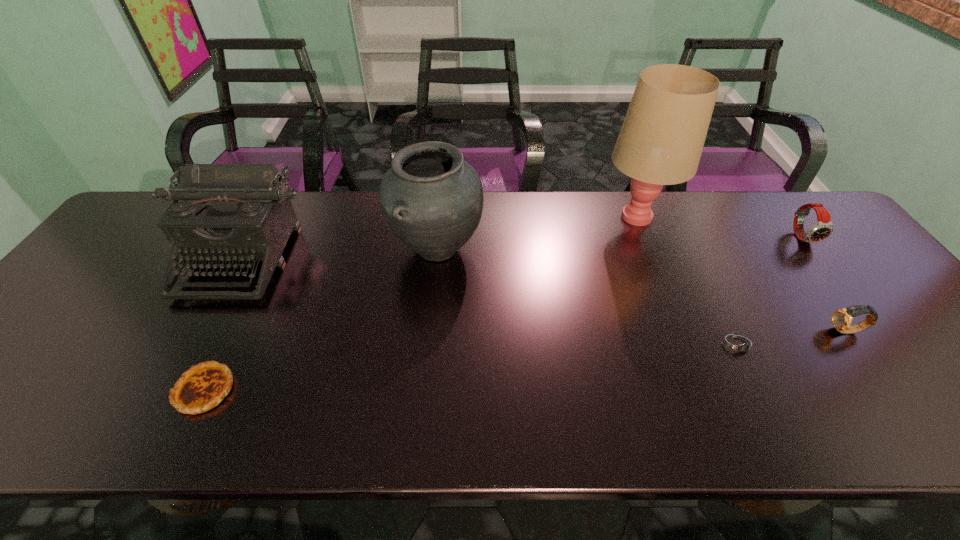
Find the location of a particular element. free space between the third shortest object and the quiche is located at coordinates (525, 360).

Identify the location of vacant region between the farthest watch and the leftmost watch. (771, 291).

Find the location of a particular element. The image size is (960, 540). vacant region between the third object from left to right and the typewriter is located at coordinates (339, 253).

Where is `vacant region between the tallest watch and the quiche`? The height and width of the screenshot is (540, 960). vacant region between the tallest watch and the quiche is located at coordinates (503, 313).

This screenshot has height=540, width=960. Find the location of `free spot between the sixth shortest object and the fifth tallest object`. free spot between the sixth shortest object and the fifth tallest object is located at coordinates (641, 290).

Identify the location of free space between the fifth shortest object and the urn. The width and height of the screenshot is (960, 540). (339, 253).

Identify the location of free space that is in between the quiche and the sixth shortest object. (321, 319).

Identify the location of free space between the shortest watch and the quiche. (472, 367).

Where is `object that stands as the closest to the nearest object`? The width and height of the screenshot is (960, 540). object that stands as the closest to the nearest object is located at coordinates (226, 212).

You are a GUI agent. You are given a task and a screenshot of the screen. Output one action in this format:
    pyautogui.click(x=<x>, y=<y>)
    Task: Click on the second closest object to the third shortest object
    The image size is (960, 540).
    Given the screenshot: What is the action you would take?
    pyautogui.click(x=823, y=228)